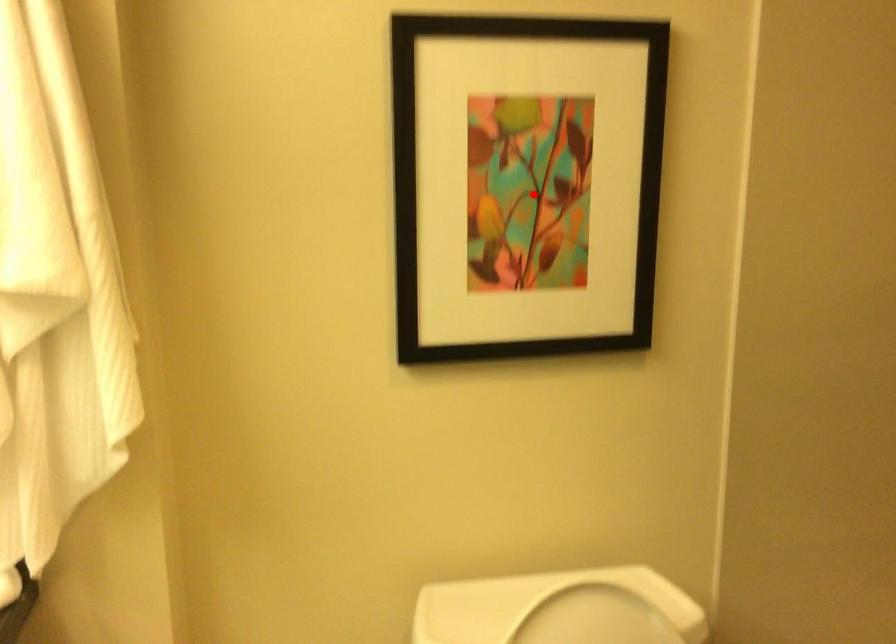
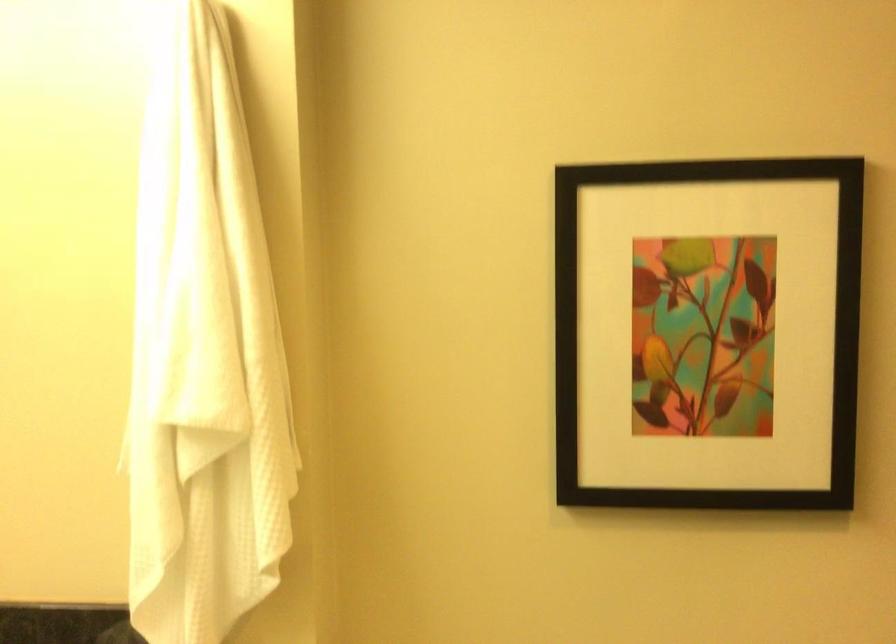
In the second image, find the point that corresponds to the highlighted location in the first image.

(708, 333)